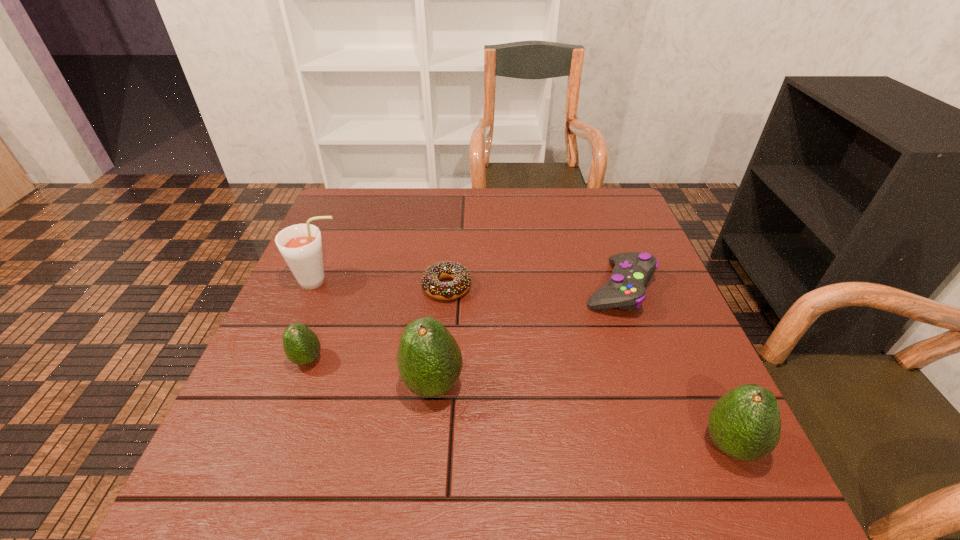
Find the location of a particular element. This screenshot has width=960, height=540. the shortest avocado is located at coordinates (301, 345).

Locate an element on the screen. The height and width of the screenshot is (540, 960). the leftmost avocado is located at coordinates (301, 345).

What are the coordinates of `the second avocado from left to right` in the screenshot? It's located at (429, 359).

At what (x,y) coordinates should I click in order to perform the action: click on the third tallest object. Please return your answer as a coordinate pair (x, y). Looking at the image, I should click on (745, 424).

Where is `the rightmost avocado`? the rightmost avocado is located at coordinates click(x=745, y=424).

You are a GUI agent. You are given a task and a screenshot of the screen. Output one action in this format:
    pyautogui.click(x=<x>, y=<y>)
    Task: Click on the control
    This screenshot has width=960, height=540.
    Given the screenshot: What is the action you would take?
    pyautogui.click(x=625, y=289)

Identify the location of doughnut. (431, 285).

Locate an element on the screen. This screenshot has height=540, width=960. root beer is located at coordinates (300, 245).

The width and height of the screenshot is (960, 540). In order to click on free region located on the right of the fourth tallest object in this screenshot , I will do 353,360.

This screenshot has height=540, width=960. Identify the location of vacant area situated on the back of the second avocado from left to right. (446, 248).